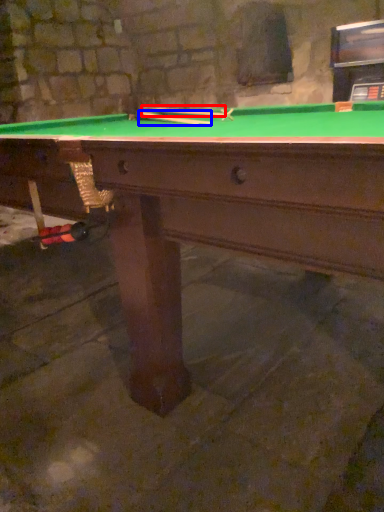
Question: Which object appears farthest to the camera in this image, cue (highlighted by a red box) or cue (highlighted by a blue box)?

Choices:
 (A) cue
 (B) cue

Answer: (A)